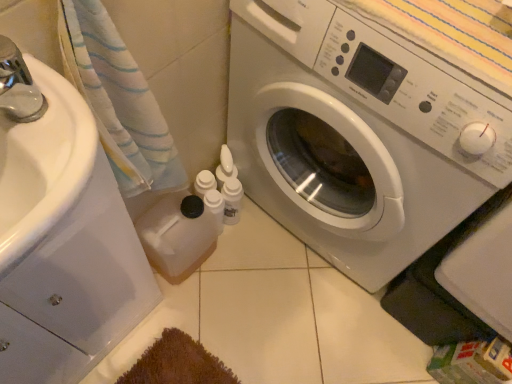
Question: Considering the positions of point (50, 296) and point (454, 102), is point (50, 296) closer or farther from the camera than point (454, 102)?

Choices:
 (A) closer
 (B) farther

Answer: (B)

Question: In the image, is white glossy drawer at left positioned in front of or behind white glossy washing machine at center?

Choices:
 (A) front
 (B) behind

Answer: (A)

Question: Which of these objects is positioned closest to the white plastic bottles at center, marked as the 1th toiletry in a left-to-right arrangement?

Choices:
 (A) white glossy washing machine at center
 (B) white fabric towel at left
 (C) white plastic bottle at lower center, arranged as the 1th toiletry when viewed from the right
 (D) white glossy drawer at left

Answer: (C)

Question: Estimate the real-world distances between objects in this image. Which object is closer to the white plastic bottle at lower center, arranged as the 1th toiletry when viewed from the right?

Choices:
 (A) white glossy washing machine at center
 (B) white plastic bottles at center, the 2th toiletry when ordered from right to left
 (C) white glossy drawer at left
 (D) white fabric towel at left

Answer: (B)